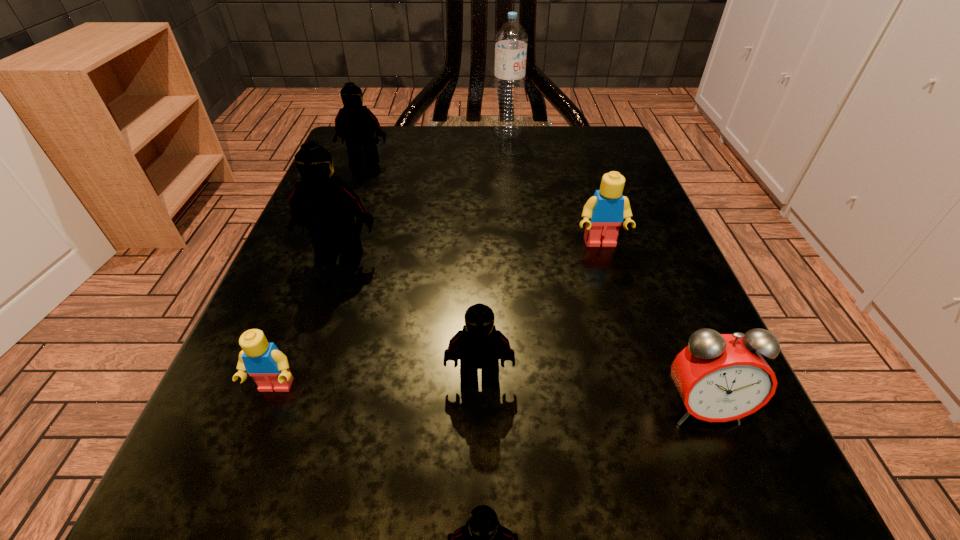
Where is `vacant area that lies between the water bottle and the third nearest black Lego`? vacant area that lies between the water bottle and the third nearest black Lego is located at coordinates (423, 194).

Locate an element on the screen. vacant region between the nearer yellow Lego and the farthest Lego is located at coordinates (320, 275).

I want to click on free space between the left yellow Lego and the water bottle, so click(x=392, y=260).

Locate an element on the screen. The width and height of the screenshot is (960, 540). free space between the tallest object and the second farthest black Lego is located at coordinates (423, 194).

Identify the location of unoccupied position between the smaller yellow Lego and the bigger yellow Lego. This screenshot has height=540, width=960. (438, 316).

Where is `free space between the third nearest black Lego and the smaller yellow Lego`? The width and height of the screenshot is (960, 540). free space between the third nearest black Lego and the smaller yellow Lego is located at coordinates (308, 322).

Where is `vacant point located between the farthest Lego and the second smallest black Lego`? This screenshot has width=960, height=540. vacant point located between the farthest Lego and the second smallest black Lego is located at coordinates (422, 270).

The width and height of the screenshot is (960, 540). Identify the location of object that is the sixth closest to the seventh shortest object. (511, 40).

The image size is (960, 540). Find the location of `object that can be found as the third closest to the sixth shortest object`. object that can be found as the third closest to the sixth shortest object is located at coordinates (604, 212).

Locate an element on the screen. This screenshot has height=540, width=960. Lego that stands as the third closest to the nearer yellow Lego is located at coordinates (482, 539).